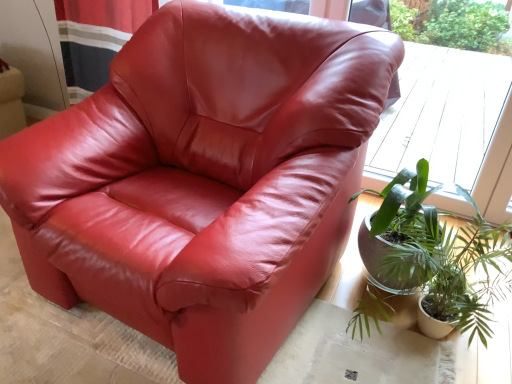
The height and width of the screenshot is (384, 512). What do you see at coordinates (451, 125) in the screenshot?
I see `transparent glass window at upper center` at bounding box center [451, 125].

Identify the location of transparent glass window at upper center. (451, 125).

In order to face transparent glass window at upper center, should I rotate leftwards or rightwards?

Turn right approximately 20.054 degrees to face it.

In order to face green leafy plant at lower right, should I rotate leftwards or rightwards?

Rotate your view right by about 23.510°.

This screenshot has width=512, height=384. Describe the element at coordinates (443, 261) in the screenshot. I see `green leafy plant at lower right` at that location.

Identify the location of green leafy plant at lower right. (443, 261).

The height and width of the screenshot is (384, 512). I want to click on transparent glass window at upper center, so click(451, 125).

Is green leafy plant at lower right at the right side of transparent glass window at upper center?

No, green leafy plant at lower right is not to the right of transparent glass window at upper center.

Which object is more forward, green leafy plant at lower right or transparent glass window at upper center?

Positioned in front is green leafy plant at lower right.

Which point is more distant from viewer, (464,325) or (465,114)?

The point (465,114) is farther from the camera.

From the image's perspective, is green leafy plant at lower right located beneath transparent glass window at upper center?

Indeed, from the image's perspective, green leafy plant at lower right is shown beneath transparent glass window at upper center.

From a real-world perspective, is green leafy plant at lower right over transparent glass window at upper center?

Incorrect, from a real-world perspective, green leafy plant at lower right is lower than transparent glass window at upper center.

Which object is wider, green leafy plant at lower right or transparent glass window at upper center?

green leafy plant at lower right.

Is green leafy plant at lower right shorter than transparent glass window at upper center?

Yes, green leafy plant at lower right is shorter than transparent glass window at upper center.

Which of these two, green leafy plant at lower right or transparent glass window at upper center, is smaller?

green leafy plant at lower right.

Can we say green leafy plant at lower right lies outside transparent glass window at upper center?

Yes, green leafy plant at lower right is outside of transparent glass window at upper center.

Are green leafy plant at lower right and transparent glass window at upper center far apart?

Indeed, green leafy plant at lower right is not near transparent glass window at upper center.

Consider the image. Is green leafy plant at lower right turned away from transparent glass window at upper center?

Correct, green leafy plant at lower right is looking away from transparent glass window at upper center.

How many degrees apart are the facing directions of green leafy plant at lower right and transparent glass window at upper center?

They differ by 4.07 degrees in their facing directions.

How far apart are green leafy plant at lower right and transparent glass window at upper center?

3.97 feet.

Identify the location of window located on the right of green leafy plant at lower right. The width and height of the screenshot is (512, 384). (451, 125).

Is transparent glass window at upper center to the left or to the right of green leafy plant at lower right in the image?

From the image, it's evident that transparent glass window at upper center is to the right of green leafy plant at lower right.

Is transparent glass window at upper center positioned in front of green leafy plant at lower right?

No, transparent glass window at upper center is behind green leafy plant at lower right.

Does point (438, 102) lie behind point (474, 309)?

Yes, it is.

From the image's perspective, which is above, transparent glass window at upper center or green leafy plant at lower right?

From the image's view, transparent glass window at upper center is above.

From a real-world perspective, is transparent glass window at upper center positioned above or below green leafy plant at lower right?

From a real-world perspective, transparent glass window at upper center is physically above green leafy plant at lower right.

Which of these two, transparent glass window at upper center or green leafy plant at lower right, is wider?

green leafy plant at lower right.

From their relative heights in the image, would you say transparent glass window at upper center is taller or shorter than green leafy plant at lower right?

transparent glass window at upper center is taller than green leafy plant at lower right.

Is transparent glass window at upper center bigger than green leafy plant at lower right?

Indeed, transparent glass window at upper center has a larger size compared to green leafy plant at lower right.

Do you think transparent glass window at upper center is within green leafy plant at lower right, or outside of it?

transparent glass window at upper center exists outside the volume of green leafy plant at lower right.

Is transparent glass window at upper center beside green leafy plant at lower right?

No, transparent glass window at upper center is not next to green leafy plant at lower right.

Consider the image. Is transparent glass window at upper center facing towards green leafy plant at lower right?

Yes.

Identify the location of houseplant that appears below the transparent glass window at upper center (from the image's perspective). Image resolution: width=512 pixels, height=384 pixels. (443, 261).

Identify the location of window to the right of green leafy plant at lower right. (451, 125).

Identify the location of houseplant lying below the transparent glass window at upper center (from the image's perspective). The width and height of the screenshot is (512, 384). (443, 261).